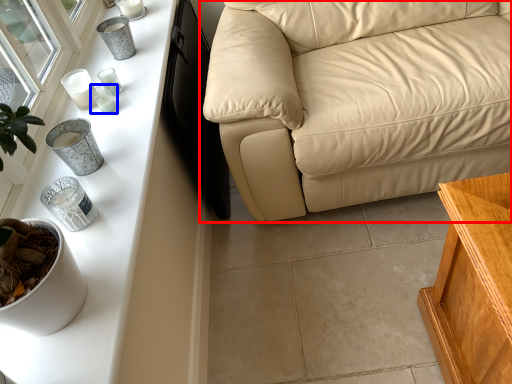
Question: Which object is closer to the camera taking this photo, studio couch (highlighted by a red box) or candle holder (highlighted by a blue box)?

Choices:
 (A) studio couch
 (B) candle holder

Answer: (A)